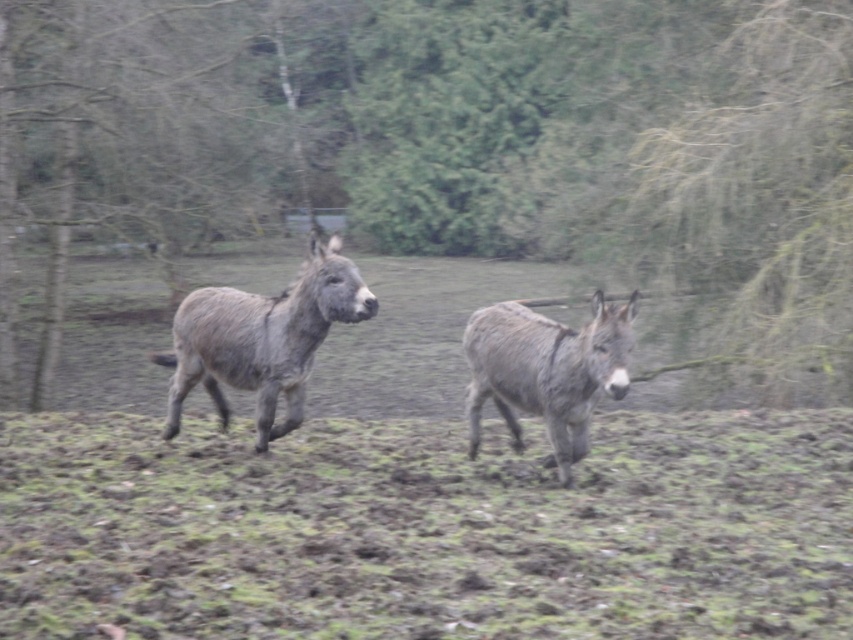
Is point (769, 157) closer to camera compared to point (267, 480)?

No, (769, 157) is behind (267, 480).

Between green leafy tree at center and green grass at center, which one has more height?

green leafy tree at center

This screenshot has width=853, height=640. I want to click on green leafy tree at center, so click(x=451, y=138).

Locate an element on the screen. The width and height of the screenshot is (853, 640). green leafy tree at center is located at coordinates (451, 138).

The image size is (853, 640). What do you see at coordinates (262, 339) in the screenshot? I see `gray fuzzy mule at left` at bounding box center [262, 339].

What do you see at coordinates (262, 339) in the screenshot? This screenshot has width=853, height=640. I see `gray fuzzy mule at left` at bounding box center [262, 339].

Locate an element on the screen. This screenshot has height=640, width=853. gray fuzzy mule at left is located at coordinates (262, 339).

In the scene shown: Which of these two, green leafy tree at center or gray rough fur mule at center, stands shorter?

With less height is gray rough fur mule at center.

Does point (679, 16) come closer to viewer compared to point (483, 387)?

No.

The width and height of the screenshot is (853, 640). Identify the location of green leafy tree at center. (451, 138).